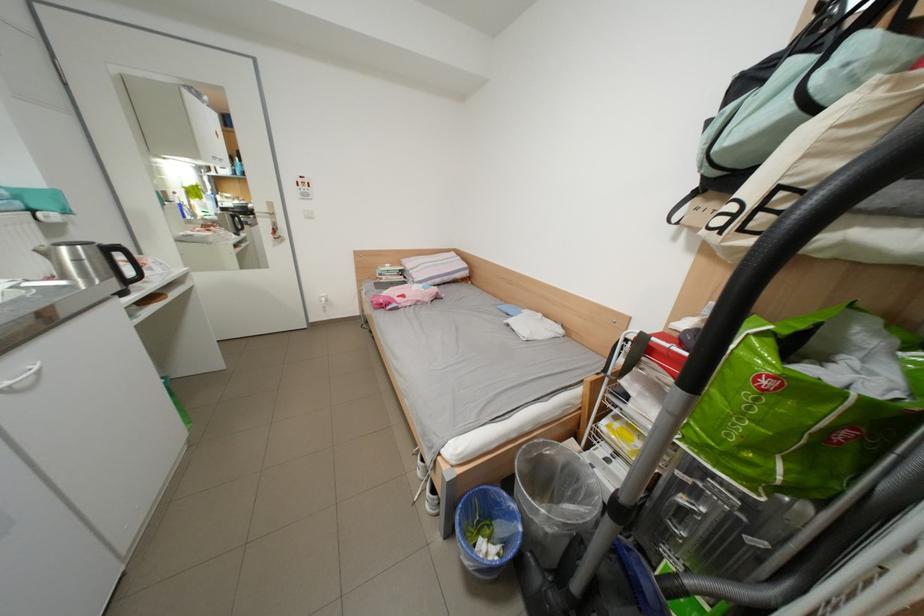
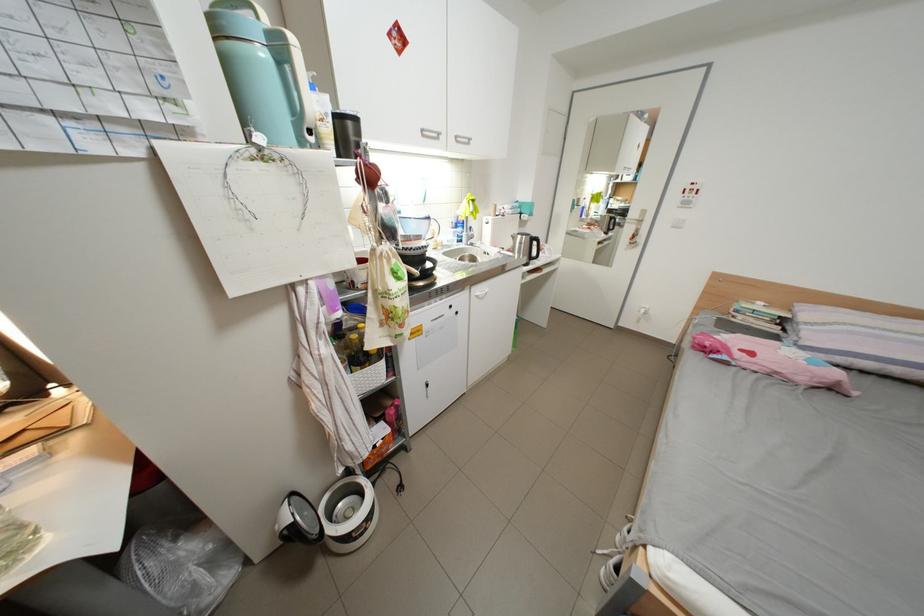
First-person continuous shooting, in which direction is the camera rotating?

The rotation direction of the camera is left-down.